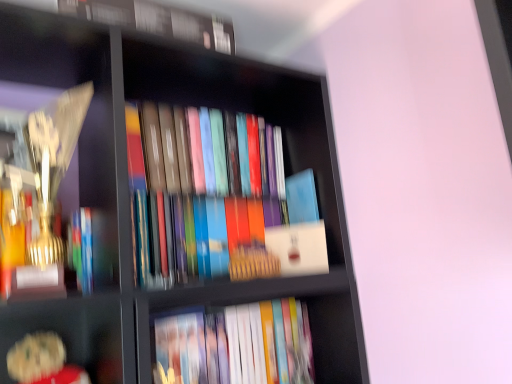
Question: Considering the relative sizes of matte hardcover book at lower center, which is the 1th book in bottom-to-top order, and blue matte book at center, marked as the 1th paperback book in a top-to-bottom arrangement, in the image provided, is matte hardcover book at lower center, which is the 1th book in bottom-to-top order, smaller than blue matte book at center, marked as the 1th paperback book in a top-to-bottom arrangement,?

Choices:
 (A) yes
 (B) no

Answer: (B)

Question: Is matte hardcover book at lower center, placed as the second book when sorted from top to bottom, with blue matte book at center, which is counted as the 2th paperback book, starting from the bottom?

Choices:
 (A) no
 (B) yes

Answer: (A)

Question: Considering the relative positions of matte hardcover book at lower center, placed as the second book when sorted from top to bottom, and blue matte book at center, marked as the 1th paperback book in a top-to-bottom arrangement, in the image provided, is matte hardcover book at lower center, placed as the second book when sorted from top to bottom, to the right of blue matte book at center, marked as the 1th paperback book in a top-to-bottom arrangement, from the viewer's perspective?

Choices:
 (A) no
 (B) yes

Answer: (A)

Question: From a real-world perspective, is matte hardcover book at lower center, placed as the second book when sorted from top to bottom, under blue matte book at center, which is counted as the 2th paperback book, starting from the bottom?

Choices:
 (A) yes
 (B) no

Answer: (A)

Question: Would you consider matte hardcover book at lower center, which is the 1th book in bottom-to-top order, to be distant from blue matte book at center, marked as the 1th paperback book in a top-to-bottom arrangement?

Choices:
 (A) no
 (B) yes

Answer: (A)

Question: Is blue matte book at center, marked as the 1th paperback book in a top-to-bottom arrangement, bigger or smaller than hardcover book at upper center, acting as the 1th book starting from the top?

Choices:
 (A) small
 (B) big

Answer: (A)

Question: From the image's perspective, is blue matte book at center, marked as the 1th paperback book in a top-to-bottom arrangement, located above or below hardcover book at upper center, which is counted as the second book, starting from the bottom?

Choices:
 (A) below
 (B) above

Answer: (A)

Question: In the image, is blue matte book at center, marked as the 1th paperback book in a top-to-bottom arrangement, on the left side or the right side of hardcover book at upper center, which is counted as the second book, starting from the bottom?

Choices:
 (A) right
 (B) left

Answer: (A)

Question: From a real-world perspective, is blue matte book at center, which is counted as the 2th paperback book, starting from the bottom, physically located above or below hardcover book at upper center, acting as the 1th book starting from the top?

Choices:
 (A) below
 (B) above

Answer: (A)

Question: Based on their positions, is blue matte book at center, which is counted as the 2th paperback book, starting from the bottom, located to the left or right of white matte book at center, the first paperback book in the bottom-to-top sequence?

Choices:
 (A) right
 (B) left

Answer: (B)

Question: In terms of width, does blue matte book at center, which is counted as the 2th paperback book, starting from the bottom, look wider or thinner when compared to white matte book at center, arranged as the 2th paperback book when viewed from the top?

Choices:
 (A) wide
 (B) thin

Answer: (B)

Question: Considering their positions, is blue matte book at center, marked as the 1th paperback book in a top-to-bottom arrangement, located in front of or behind white matte book at center, the first paperback book in the bottom-to-top sequence?

Choices:
 (A) behind
 (B) front

Answer: (A)

Question: From their relative heights in the image, would you say blue matte book at center, which is counted as the 2th paperback book, starting from the bottom, is taller or shorter than white matte book at center, arranged as the 2th paperback book when viewed from the top?

Choices:
 (A) short
 (B) tall

Answer: (B)

Question: Considering the relative positions of matte hardcover book at lower center, which is the 1th book in bottom-to-top order, and blue matte book at center, marked as the 1th paperback book in a top-to-bottom arrangement, in the image provided, is matte hardcover book at lower center, which is the 1th book in bottom-to-top order, to the left or to the right of blue matte book at center, marked as the 1th paperback book in a top-to-bottom arrangement,?

Choices:
 (A) left
 (B) right

Answer: (A)

Question: From the image's perspective, is matte hardcover book at lower center, placed as the second book when sorted from top to bottom, positioned above or below blue matte book at center, marked as the 1th paperback book in a top-to-bottom arrangement?

Choices:
 (A) below
 (B) above

Answer: (A)